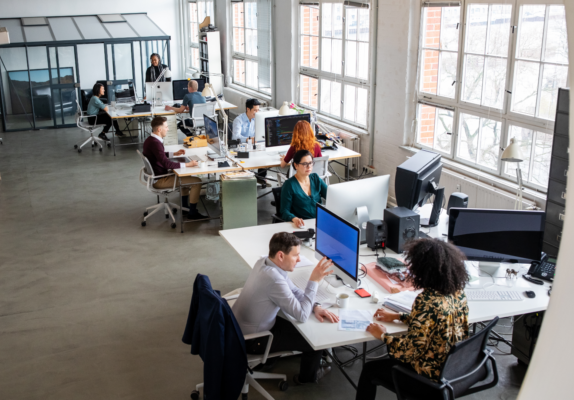
Locate an element on the screen. bottom of windows is located at coordinates (531, 153), (480, 134), (437, 124), (355, 108), (321, 92), (308, 87), (263, 73), (247, 72), (239, 68), (193, 58).